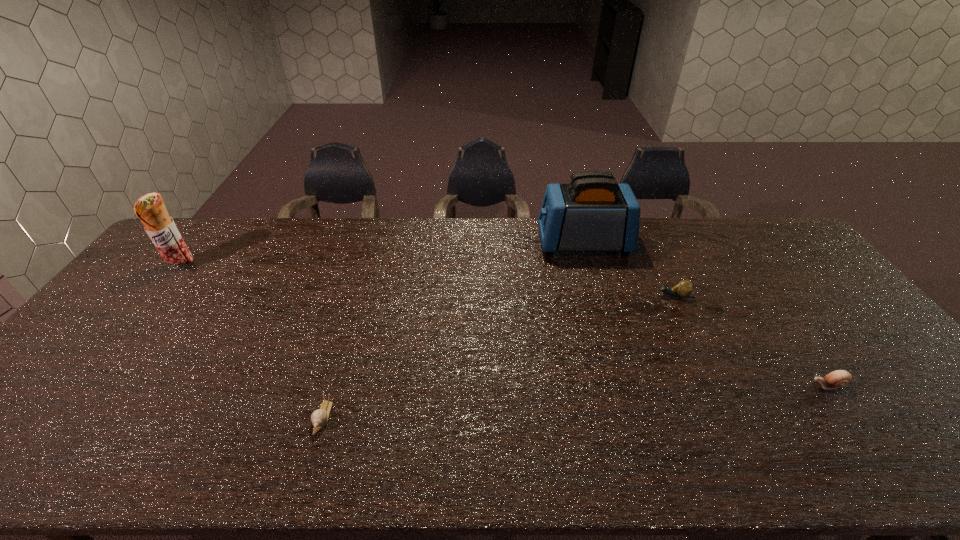
You are a GUI agent. You are given a task and a screenshot of the screen. Output one action in this format:
    pyautogui.click(x=<x>, y=<y>)
    Task: Click on the object at the near edge
    This screenshot has height=540, width=960.
    Given the screenshot: What is the action you would take?
    pyautogui.click(x=319, y=418)

Locate an element on the screen. This screenshot has width=960, height=540. object that is at the left edge is located at coordinates (150, 209).

I want to click on free space at the far edge, so click(x=409, y=249).

Image resolution: width=960 pixels, height=540 pixels. In the image, there is a desktop. In order to click on vacant space at the near edge in this screenshot , I will do `click(275, 450)`.

Where is `free region at the left edge`? The height and width of the screenshot is (540, 960). free region at the left edge is located at coordinates (163, 278).

Find the location of `vacant space at the right edge`. vacant space at the right edge is located at coordinates (899, 428).

This screenshot has height=540, width=960. I want to click on vacant point located between the second escargot from left to right and the third object from right to left, so click(628, 269).

This screenshot has width=960, height=540. Find the location of `empty space that is in between the shortest object and the leftmost object`. empty space that is in between the shortest object and the leftmost object is located at coordinates (252, 342).

Locate an element on the screen. The width and height of the screenshot is (960, 540). free spot between the toaster and the shortest object is located at coordinates (453, 330).

Locate an element on the screen. vacant area between the third object from left to right and the fourth object from left to right is located at coordinates (628, 269).